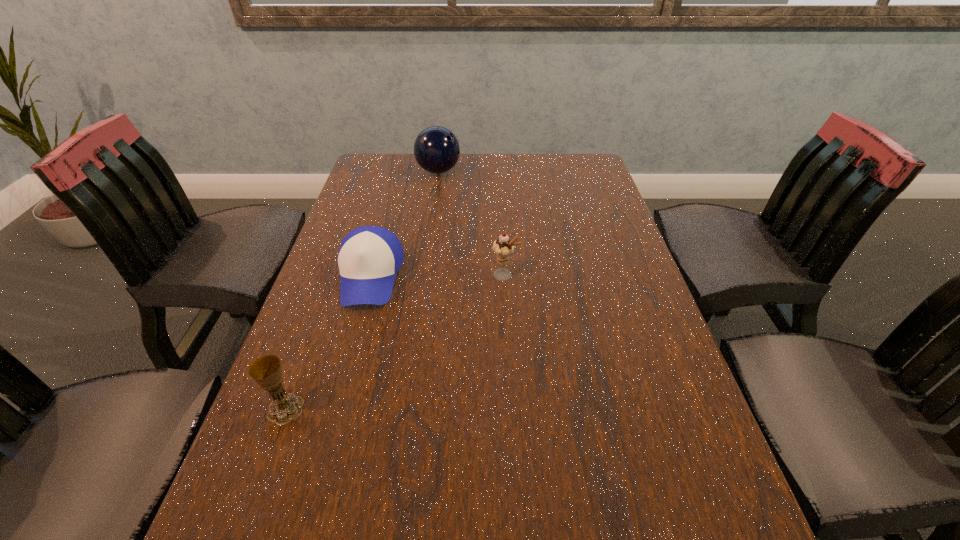
Where is `chalice that is at the left edge`? The width and height of the screenshot is (960, 540). chalice that is at the left edge is located at coordinates (266, 371).

At what (x,y) coordinates should I click in order to perform the action: click on baseball cap at the left edge. Please return your answer as a coordinate pair (x, y). Looking at the image, I should click on (369, 257).

This screenshot has width=960, height=540. Identify the location of free region at the far edge. (541, 172).

You are a GUI agent. You are given a task and a screenshot of the screen. Output one action in this format:
    pyautogui.click(x=<x>, y=<y>)
    Task: Click on the free space at the left edge
    The width and height of the screenshot is (960, 540).
    Given the screenshot: What is the action you would take?
    pyautogui.click(x=314, y=400)

This screenshot has width=960, height=540. In order to click on free spot at the right edge of the desktop in this screenshot , I will do `click(604, 304)`.

This screenshot has height=540, width=960. In order to click on vacant space at the far left corner in this screenshot , I will do `click(392, 157)`.

What are the coordinates of `blank space at the far right corner of the desktop` in the screenshot? It's located at (566, 165).

The image size is (960, 540). What are the coordinates of `empty location between the nearest object and the shortest object` in the screenshot? It's located at (327, 343).

In order to click on free space between the icecream and the bowling ball in this screenshot , I will do `click(471, 223)`.

Image resolution: width=960 pixels, height=540 pixels. I want to click on vacant point located between the shortest object and the chalice, so click(327, 343).